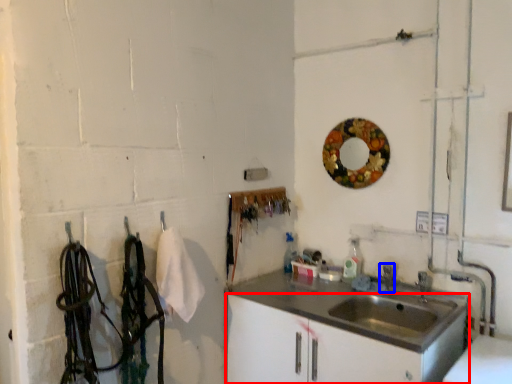
Question: Which object appears farthest to the camera in this image, bathroom cabinet (highlighted by a red box) or faucet (highlighted by a blue box)?

Choices:
 (A) bathroom cabinet
 (B) faucet

Answer: (B)